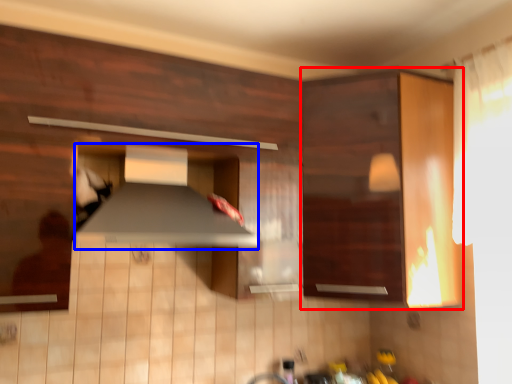
Question: Among these objects, which one is farthest to the camera, cabinetry (highlighted by a red box) or exhaust hood (highlighted by a blue box)?

Choices:
 (A) cabinetry
 (B) exhaust hood

Answer: (A)